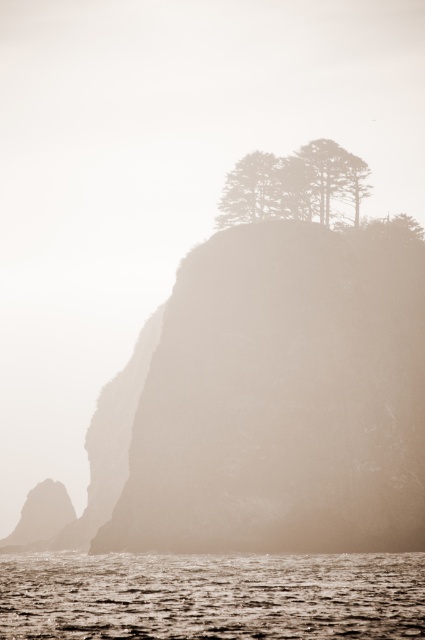
Question: Which object is the closest to the smooth water at lower center?

Choices:
 (A) green textured tree at upper center
 (B) silhouetted trees at upper center
 (C) smooth beige cliff at center

Answer: (C)

Question: Does smooth water at lower center appear over silhouetted trees at upper center?

Choices:
 (A) no
 (B) yes

Answer: (A)

Question: Is smooth water at lower center above green textured tree at upper center?

Choices:
 (A) yes
 (B) no

Answer: (B)

Question: Can you confirm if smooth beige cliff at center is smaller than silhouetted trees at upper center?

Choices:
 (A) no
 (B) yes

Answer: (A)

Question: Which point is closer to the camera?

Choices:
 (A) (350, 180)
 (B) (167, 570)
 (C) (229, 196)

Answer: (B)

Question: Which point is farther to the camera?

Choices:
 (A) (303, 609)
 (B) (237, 193)

Answer: (B)